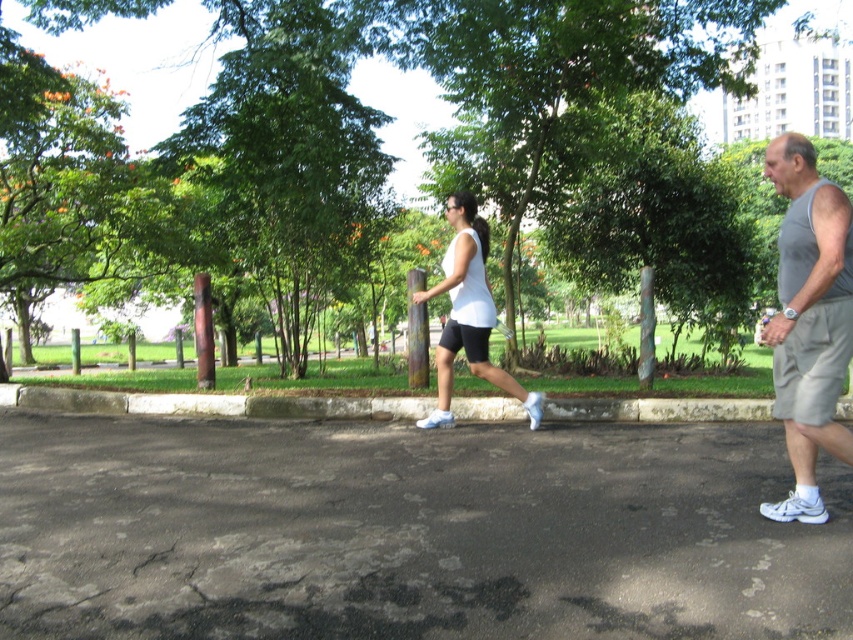
You are a photographer trying to capture both the gray fabric tank top at right and the green leafy tree at center in a single frame. Based on their sizes, which object should you focus on first to ensure both fit properly in the photo?

The gray fabric tank top at right has a lesser width compared to the green leafy tree at center. To ensure both fit properly in the photo, focus on positioning the wider green leafy tree at center first, then adjust the frame to include the narrower gray fabric tank top at right.

You are designing a new clothing line and want to ensure proper sizing. If you have a customer who prefers wider tops and narrower bottoms, which item from the image would better fit their preference between the gray fabric tank top at right and the white matte shorts at center?

The gray fabric tank top at right has a greater width than the white matte shorts at center, making it suitable for customers preferring wider tops and narrower bottoms.

You are a drone operator tasked with capturing aerial footage of the gray fabric tank top at right and the green leafy tree at center. The drone has a maximum effective range of 35 meters. Can the drone capture both subjects within its range simultaneously?

The distance between the gray fabric tank top at right and the green leafy tree at center is 36.05 meters. Since the drone can only operate effectively within 35 meters, it cannot capture both subjects simultaneously as the distance exceeds its range.